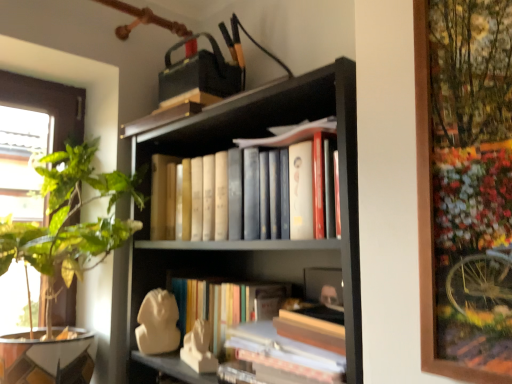
Describe the element at coordinates (259, 240) in the screenshot. The width and height of the screenshot is (512, 384). I see `matte black bookcase at center` at that location.

The width and height of the screenshot is (512, 384). In order to click on green leafy plant at left in this screenshot , I will do `click(71, 216)`.

What do you see at coordinates (71, 216) in the screenshot? I see `green leafy plant at left` at bounding box center [71, 216].

The image size is (512, 384). What are the coordinates of `matte black bookcase at center` in the screenshot? It's located at (259, 240).

Is matte black bookcase at center bigger than green leafy plant at left?

Yes.

Considering the relative positions of matte black bookcase at center and green leafy plant at left in the image provided, is matte black bookcase at center behind green leafy plant at left?

No, matte black bookcase at center is closer to the camera.

From the image's perspective, relative to green leafy plant at left, is matte black bookcase at center above or below?

From the image's perspective, matte black bookcase at center appears above green leafy plant at left.

Considering the sizes of hardcover books at center and green leafy plant at left in the image, is hardcover books at center bigger or smaller than green leafy plant at left?

In the image, hardcover books at center appears to be smaller than green leafy plant at left.

From a real-world perspective, who is located higher, hardcover books at center or green leafy plant at left?

hardcover books at center.

Between hardcover books at center and green leafy plant at left, which one appears on the left side from the viewer's perspective?

Positioned to the left is green leafy plant at left.

In the scene shown: Which of these two, green leafy plant at left or matte black bookcase at center, is smaller?

green leafy plant at left is smaller.

Considering the relative positions of green leafy plant at left and matte black bookcase at center in the image provided, is green leafy plant at left to the left of matte black bookcase at center from the viewer's perspective?

Yes, green leafy plant at left is to the left of matte black bookcase at center.

Is green leafy plant at left positioned in front of matte black bookcase at center?

No, green leafy plant at left is further to the viewer.

In the scene shown: From the image's perspective, is green leafy plant at left above or below matte black bookcase at center?

Based on their image positions, green leafy plant at left is located beneath matte black bookcase at center.

The height and width of the screenshot is (384, 512). In order to click on book that appears on the left of matte black bookcase at center in this screenshot , I will do `click(160, 205)`.

From a real-world perspective, is hardcover books at center above or below matte black bookcase at center?

Clearly, from a real-world perspective, hardcover books at center is above matte black bookcase at center.

Considering the positions of objects hardcover books at center and matte black bookcase at center in the image provided, who is in front, hardcover books at center or matte black bookcase at center?

matte black bookcase at center is in front.

Considering the sizes of objects hardcover books at center and matte black bookcase at center in the image provided, who is shorter, hardcover books at center or matte black bookcase at center?

hardcover books at center is shorter.

Relative to hardcover books at center, is matte black bookcase at center in front or behind?

matte black bookcase at center is positioned closer to the viewer than hardcover books at center.

In the scene shown: Is matte black bookcase at center shorter than hardcover books at center?

In fact, matte black bookcase at center may be taller than hardcover books at center.

Is point (182, 120) closer to viewer compared to point (234, 159)?

No.

Considering the relative sizes of matte black bookcase at center and hardcover books at center in the image provided, is matte black bookcase at center thinner than hardcover books at center?

No.

Is green leafy plant at left turned away from hardcover books at center?

No, green leafy plant at left is not facing away from hardcover books at center.

Considering the sizes of objects green leafy plant at left and hardcover books at center in the image provided, who is thinner, green leafy plant at left or hardcover books at center?

hardcover books at center is thinner.

What's the angular difference between green leafy plant at left and hardcover books at center's facing directions?

The angle between the facing direction of green leafy plant at left and the facing direction of hardcover books at center is 83.5 degrees.

In order to click on houseplant in front of the hardcover books at center in this screenshot , I will do `click(71, 216)`.

Find the location of a particular element. The height and width of the screenshot is (384, 512). bookcase above the green leafy plant at left (from a real-world perspective) is located at coordinates (259, 240).

Find the location of a particular element. houseplant below the hardcover books at center (from the image's perspective) is located at coordinates (71, 216).

Looking at the image, which one is located closer to hardcover books at center, matte black bookcase at center or green leafy plant at left?

Among the two, matte black bookcase at center is located nearer to hardcover books at center.

Based on their spatial positions, is green leafy plant at left or matte black bookcase at center closer to hardcover books at center?

matte black bookcase at center is closer to hardcover books at center.

Based on the photo, looking at the image, which one is located closer to green leafy plant at left, matte black bookcase at center or hardcover books at center?

Based on the image, hardcover books at center appears to be nearer to green leafy plant at left.

Based on their spatial positions, is hardcover books at center or matte black bookcase at center closer to green leafy plant at left?

hardcover books at center lies closer to green leafy plant at left than the other object.

From the image, which object appears to be farther from matte black bookcase at center, green leafy plant at left or hardcover books at center?

green leafy plant at left is positioned further to the anchor matte black bookcase at center.

Which object lies nearer to the anchor point matte black bookcase at center, hardcover books at center or green leafy plant at left?

The object closer to matte black bookcase at center is hardcover books at center.

In order to click on book between green leafy plant at left and matte black bookcase at center in the horizontal direction in this screenshot , I will do `click(160, 205)`.